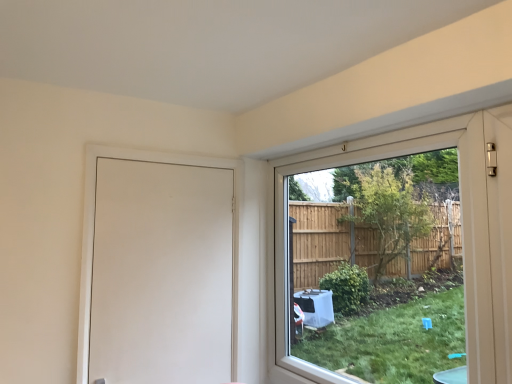
Question: Considering the positions of clear glass window at right and white matte door at left in the image, is clear glass window at right taller or shorter than white matte door at left?

Choices:
 (A) tall
 (B) short

Answer: (A)

Question: Which is correct: clear glass window at right is inside white matte door at left, or outside of it?

Choices:
 (A) outside
 (B) inside

Answer: (A)

Question: Visually, is clear glass window at right positioned to the left or to the right of white matte door at left?

Choices:
 (A) right
 (B) left

Answer: (A)

Question: Considering the positions of white matte door at left and clear glass window at right in the image, is white matte door at left bigger or smaller than clear glass window at right?

Choices:
 (A) small
 (B) big

Answer: (A)

Question: From the image's perspective, is white matte door at left located above or below clear glass window at right?

Choices:
 (A) above
 (B) below

Answer: (B)

Question: Is white matte door at left spatially inside clear glass window at right, or outside of it?

Choices:
 (A) inside
 (B) outside

Answer: (B)

Question: From their relative heights in the image, would you say white matte door at left is taller or shorter than clear glass window at right?

Choices:
 (A) tall
 (B) short

Answer: (B)